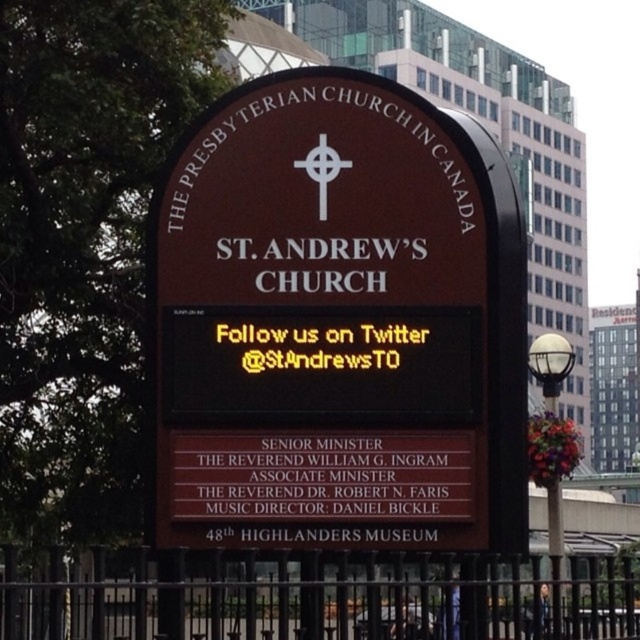
You are standing 200 feet away from the signboard of St. Andrew s Church. Can you see the point at coordinates point (220, 236) on the signboard clearly?

The point at coordinates point (220, 236) is 239.45 feet away from the viewer. Since you are only 200 feet away, you are closer than the point s distance, so you can see it clearly.

You are standing in front of the St. Andrew Church signboard. You see the brown polished wood sign at center and the black metal fence at lower center. Which object is taller?

The brown polished wood sign at center is much taller than the black metal fence at lower center.

You are standing in front of the St. Andrew Church signboard and want to touch both the brown polished wood sign at center and the black metal fence at lower center. Which object will you reach first?

You will reach the brown polished wood sign at center first because it is closer to you than the black metal fence at lower center, which is further away.